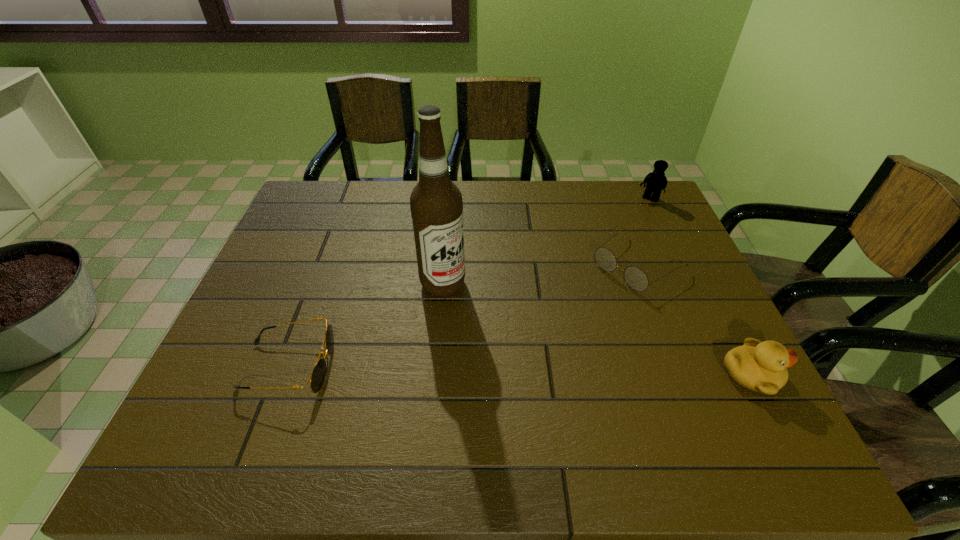
Where is `free spot on the desktop that is between the sunglasses and the third shortest object and is positioned on the temples of the spectacles`? The image size is (960, 540). free spot on the desktop that is between the sunglasses and the third shortest object and is positioned on the temples of the spectacles is located at coordinates [x=491, y=370].

I want to click on free spot on the desktop that is between the leftmost object and the third tallest object and is positioned on the label of the fourth object from right to left, so tap(568, 372).

This screenshot has height=540, width=960. I want to click on vacant space on the desktop that is between the sunglasses and the third tallest object and is positioned on the front-facing side of the second tallest object, so click(x=540, y=371).